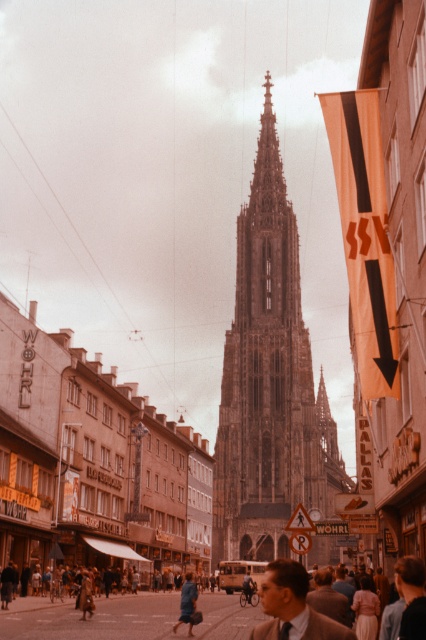
Identify the location of blue fabric coat at lower center. point(187,604).

Does blue fabric coat at lower center appear over dark blue fabric coat at center?

Incorrect, blue fabric coat at lower center is not positioned above dark blue fabric coat at center.

Does point (187, 602) come in front of point (80, 600)?

Yes.

Where is `blue fabric coat at lower center`? The image size is (426, 640). blue fabric coat at lower center is located at coordinates (187, 604).

Is brown stone tower at center to the left of blue fabric coat at lower center from the viewer's perspective?

In fact, brown stone tower at center is to the right of blue fabric coat at lower center.

Between brown stone tower at center and blue fabric coat at lower center, which one has more height?

brown stone tower at center

This screenshot has height=640, width=426. Describe the element at coordinates (270, 381) in the screenshot. I see `brown stone tower at center` at that location.

Locate an element on the screen. This screenshot has height=640, width=426. brown stone tower at center is located at coordinates (270, 381).

Between brown stone tower at center and dark blue fabric coat at center, which one has more height?

Standing taller between the two is brown stone tower at center.

Does brown stone tower at center come behind dark blue fabric coat at center?

Yes, brown stone tower at center is further from the viewer.

Describe the element at coordinates (270, 381) in the screenshot. I see `brown stone tower at center` at that location.

I want to click on brown stone tower at center, so click(x=270, y=381).